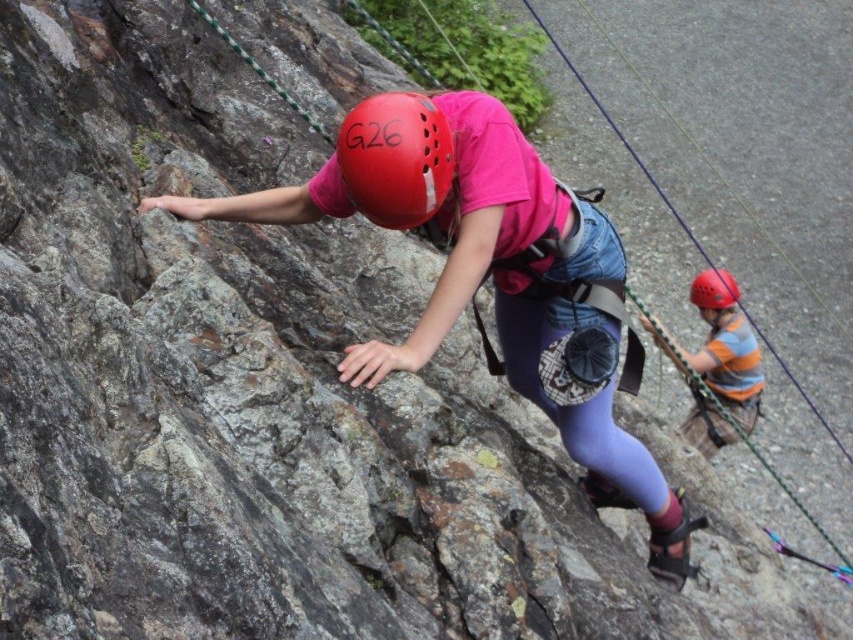
Which of these two, matte red helmet at center or striped cotton shirt at right, stands shorter?

With less height is matte red helmet at center.

Is point (366, 188) positioned in front of point (693, 356)?

Yes, it is.

Where is `matte red helmet at center`? This screenshot has width=853, height=640. matte red helmet at center is located at coordinates (396, 157).

Is matte red helmet at center above matte red helmet at right?

Yes.

Can you confirm if matte red helmet at center is wider than matte red helmet at right?

Yes, matte red helmet at center is wider than matte red helmet at right.

This screenshot has width=853, height=640. What do you see at coordinates (396, 157) in the screenshot? I see `matte red helmet at center` at bounding box center [396, 157].

Image resolution: width=853 pixels, height=640 pixels. What are the coordinates of `matte red helmet at center` in the screenshot? It's located at (396, 157).

Who is taller, matte pink shirt at center or matte red helmet at right?

With more height is matte pink shirt at center.

Is matte pink shirt at center taller than matte red helmet at right?

Yes, matte pink shirt at center is taller than matte red helmet at right.

Between point (236, 211) and point (706, 269), which one is positioned in front?

Point (236, 211)

You are a GUI agent. You are given a task and a screenshot of the screen. Output one action in this format:
    pyautogui.click(x=<x>, y=<y>)
    Task: Click on the matte pink shirt at center
    
    Given the screenshot: What is the action you would take?
    pyautogui.click(x=488, y=273)